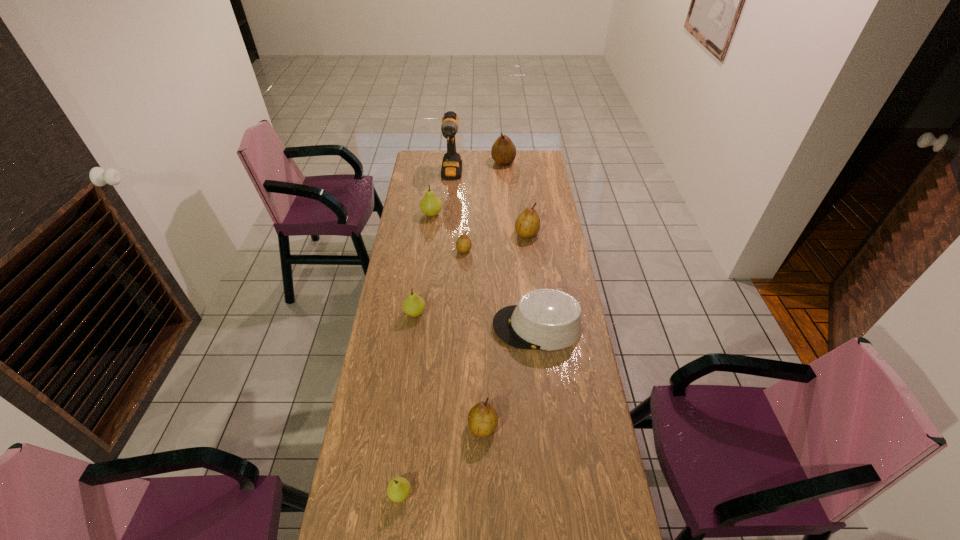
Identify the location of hat at the right edge. (545, 319).

Where is `vacant space at the far edge of the desktop`? The image size is (960, 540). vacant space at the far edge of the desktop is located at coordinates (483, 171).

At what (x,y) coordinates should I click in order to perform the action: click on free region at the left edge of the desktop. Please return your answer as a coordinate pair (x, y). Looking at the image, I should click on (394, 360).

Locate an element on the screen. The height and width of the screenshot is (540, 960). free location at the right edge of the desktop is located at coordinates (551, 219).

Image resolution: width=960 pixels, height=540 pixels. What are the coordinates of `free spot at the far left corner of the desktop` in the screenshot? It's located at (433, 161).

The height and width of the screenshot is (540, 960). What are the coordinates of `free space at the far right corner of the desktop` in the screenshot? It's located at (543, 151).

This screenshot has width=960, height=540. I want to click on unoccupied area between the hat and the second tallest object, so click(x=520, y=244).

At what (x,y) coordinates should I click in order to perform the action: click on vacant point located between the third nearest pear and the fifth nearest object. Please return your answer as a coordinate pair (x, y). This screenshot has height=540, width=960. Looking at the image, I should click on (440, 281).

Where is `free spot between the nearest brown pear and the hat`? The height and width of the screenshot is (540, 960). free spot between the nearest brown pear and the hat is located at coordinates (510, 376).

Where is `free spot between the fourth farthest object and the second nearest green pear`? The image size is (960, 540). free spot between the fourth farthest object and the second nearest green pear is located at coordinates (471, 273).